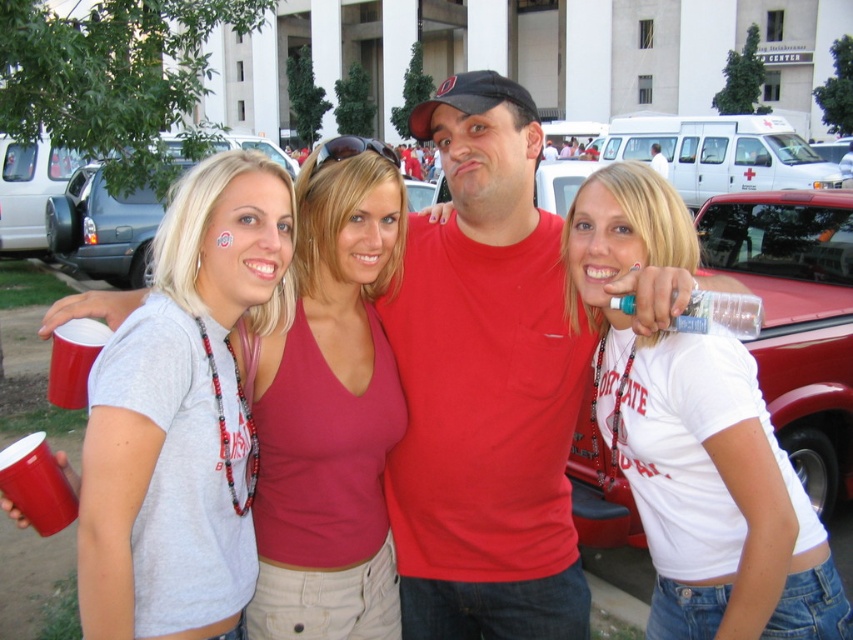
You are standing in front of the group of four people in the image. There are two points marked in the scene. Which point, point (405, 346) or point (310, 157), is closer to you?

Point (405, 346) is closer to you than point (310, 157).